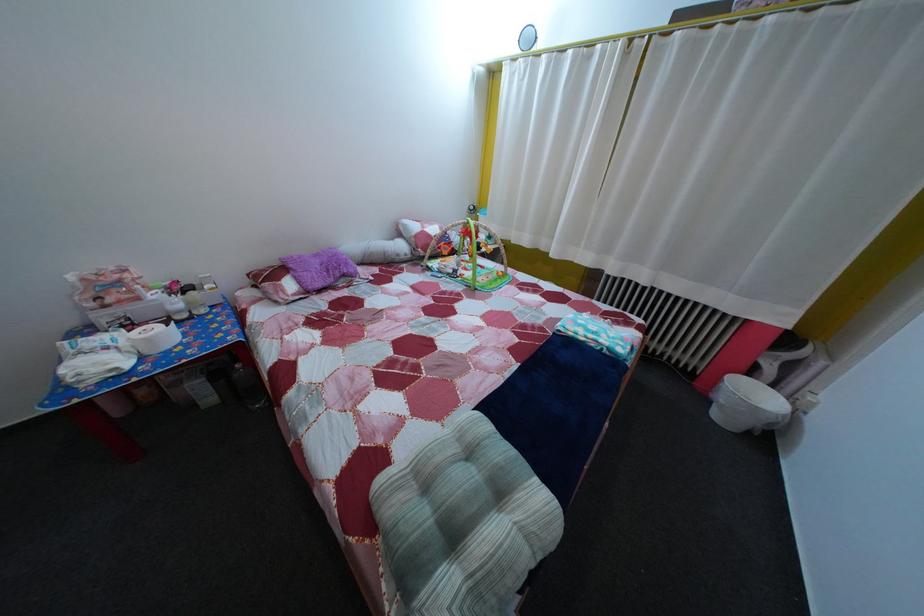
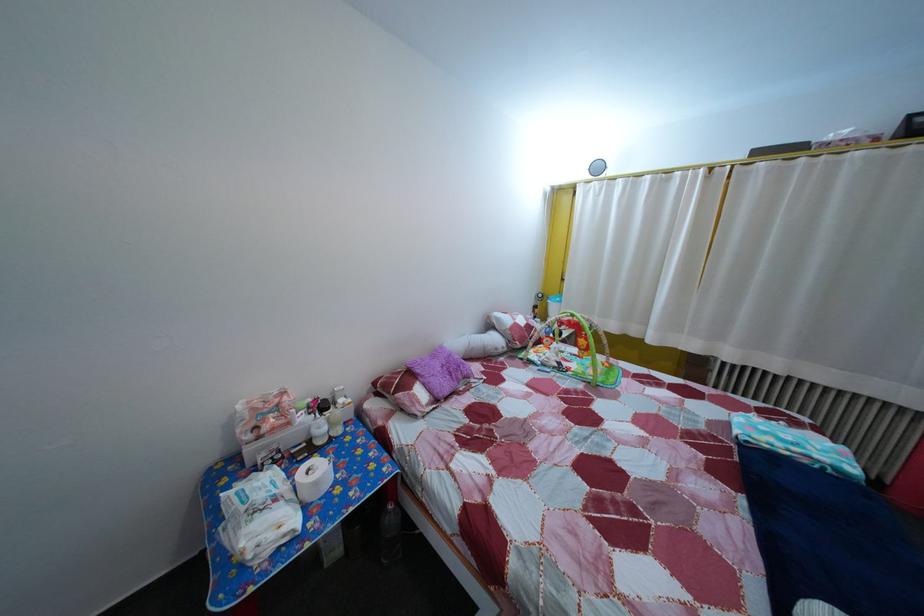
Locate, in the second image, the point that corresponds to (x=165, y=304) in the first image.

(311, 427)